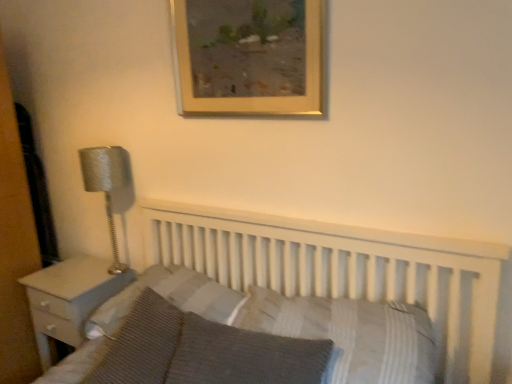
In order to face gold wooden picture frame at upper center, should I rotate leftwards or rightwards?

To align with it, rotate left about 1.813°.

This screenshot has width=512, height=384. Describe the element at coordinates (69, 299) in the screenshot. I see `white wood nightstand at left` at that location.

The width and height of the screenshot is (512, 384). Describe the element at coordinates (244, 356) in the screenshot. I see `knitted gray pillow at lower center, marked as the second pillow in a right-to-left arrangement` at that location.

The image size is (512, 384). I want to click on silver textured lamp at left, so click(x=106, y=185).

What are the coordinates of `gold wooden picture frame at upper center` in the screenshot? It's located at [x=249, y=57].

Between knitted gray pillow at lower center, marked as the second pillow in a right-to-left arrangement, and white wood nightstand at left, which one has smaller size?

knitted gray pillow at lower center, marked as the second pillow in a right-to-left arrangement, is smaller.

Is knitted gray pillow at lower center, marked as the second pillow in a right-to-left arrangement, shorter than white wood nightstand at left?

Yes.

Is point (273, 356) positioned in front of point (103, 273)?

Yes, point (273, 356) is in front of point (103, 273).

Does knitted gray pillow at lower center, which is the third pillow in left-to-right order, turn towards white wood nightstand at left?

No, knitted gray pillow at lower center, which is the third pillow in left-to-right order, is not facing towards white wood nightstand at left.

Considering the sizes of silver textured lamp at left and gold wooden picture frame at upper center in the image, is silver textured lamp at left taller or shorter than gold wooden picture frame at upper center?

Clearly, silver textured lamp at left is taller compared to gold wooden picture frame at upper center.

Are silver textured lamp at left and gold wooden picture frame at upper center far apart?

No, there isn't a large distance between silver textured lamp at left and gold wooden picture frame at upper center.

Who is bigger, silver textured lamp at left or gold wooden picture frame at upper center?

silver textured lamp at left is bigger.

Between silver textured lamp at left and gold wooden picture frame at upper center, which one has larger width?

silver textured lamp at left is wider.

Do you think white wood bed at center is within gold wooden picture frame at upper center, or outside of it?

white wood bed at center is not enclosed by gold wooden picture frame at upper center.

Considering the sizes of objects white wood bed at center and gold wooden picture frame at upper center in the image provided, who is thinner, white wood bed at center or gold wooden picture frame at upper center?

gold wooden picture frame at upper center.

Does white wood bed at center have a lesser height compared to gold wooden picture frame at upper center?

Incorrect, the height of white wood bed at center does not fall short of that of gold wooden picture frame at upper center.

From the image's perspective, which one is positioned lower, white textured pillow at center, positioned as the 4th pillow in left-to-right order, or knitted fabric pillow at lower left, acting as the first pillow starting from the left?

knitted fabric pillow at lower left, acting as the first pillow starting from the left, is shown below in the image.

From a real-world perspective, is white textured pillow at center, positioned as the 4th pillow in left-to-right order, positioned above or below knitted fabric pillow at lower left, marked as the fourth pillow in a right-to-left arrangement?

white textured pillow at center, positioned as the 4th pillow in left-to-right order, is above knitted fabric pillow at lower left, marked as the fourth pillow in a right-to-left arrangement.

Can you confirm if white textured pillow at center, which appears as the 1th pillow when viewed from the right, is wider than knitted fabric pillow at lower left, acting as the first pillow starting from the left?

Correct, the width of white textured pillow at center, which appears as the 1th pillow when viewed from the right, exceeds that of knitted fabric pillow at lower left, acting as the first pillow starting from the left.

Which of these two, white textured pillow at center, which appears as the 1th pillow when viewed from the right, or knitted fabric pillow at lower left, acting as the first pillow starting from the left, is smaller?

Smaller between the two is knitted fabric pillow at lower left, acting as the first pillow starting from the left.

From the image's perspective, which is above, gold wooden picture frame at upper center or striped fabric pillow at center, which ranks as the 3th pillow in right-to-left order?

gold wooden picture frame at upper center appears higher in the image.

From a real-world perspective, is gold wooden picture frame at upper center positioned over striped fabric pillow at center, the second pillow from the left, based on gravity?

Yes.

Is gold wooden picture frame at upper center taller than striped fabric pillow at center, the second pillow from the left?

Correct, gold wooden picture frame at upper center is much taller as striped fabric pillow at center, the second pillow from the left.

Between gold wooden picture frame at upper center and striped fabric pillow at center, which ranks as the 3th pillow in right-to-left order, which one appears on the left side from the viewer's perspective?

From the viewer's perspective, striped fabric pillow at center, which ranks as the 3th pillow in right-to-left order, appears more on the left side.

Consider the image. Between white wood nightstand at left and white textured pillow at center, positioned as the 4th pillow in left-to-right order, which one has larger size?

white wood nightstand at left is bigger.

In the scene shown: Which is correct: white wood nightstand at left is inside white textured pillow at center, which appears as the 1th pillow when viewed from the right, or outside of it?

white wood nightstand at left is not inside white textured pillow at center, which appears as the 1th pillow when viewed from the right, it's outside.

Can you tell me how much white wood nightstand at left and white textured pillow at center, which appears as the 1th pillow when viewed from the right, differ in facing direction?

The angular difference between white wood nightstand at left and white textured pillow at center, which appears as the 1th pillow when viewed from the right, is 3.62 degrees.

Is silver textured lamp at left inside knitted gray pillow at lower center, marked as the second pillow in a right-to-left arrangement?

No, silver textured lamp at left is not inside knitted gray pillow at lower center, marked as the second pillow in a right-to-left arrangement.

Could you tell me if knitted gray pillow at lower center, marked as the second pillow in a right-to-left arrangement, is facing silver textured lamp at left?

No, knitted gray pillow at lower center, marked as the second pillow in a right-to-left arrangement, is not oriented towards silver textured lamp at left.

At what (x,y) coordinates should I click in order to perform the action: click on lamp that appears above the knitted gray pillow at lower center, which is the third pillow in left-to-right order (from a real-world perspective). Please return your answer as a coordinate pair (x, y). This screenshot has height=384, width=512. Looking at the image, I should click on (106, 185).

From a real-world perspective, which is physically below, knitted gray pillow at lower center, marked as the second pillow in a right-to-left arrangement, or silver textured lamp at left?

knitted gray pillow at lower center, marked as the second pillow in a right-to-left arrangement, is physically lower.

You are a GUI agent. You are given a task and a screenshot of the screen. Output one action in this format:
    pyautogui.click(x=<x>, y=<y>)
    Task: Click on the nightstand that appears below the knitted gray pillow at lower center, marked as the second pillow in a right-to-left arrangement (from a real-world perspective)
    Image resolution: width=512 pixels, height=384 pixels.
    Given the screenshot: What is the action you would take?
    pyautogui.click(x=69, y=299)

The height and width of the screenshot is (384, 512). In order to click on lamp on the left of gold wooden picture frame at upper center in this screenshot , I will do `click(106, 185)`.

Consider the image. Considering their positions, is knitted gray pillow at lower center, which is the third pillow in left-to-right order, positioned further to striped fabric pillow at center, the second pillow from the left, than white wood bed at center?

knitted gray pillow at lower center, which is the third pillow in left-to-right order.

Which object lies nearer to the anchor point striped fabric pillow at center, the second pillow from the left, knitted fabric pillow at lower left, acting as the first pillow starting from the left, or white wood nightstand at left?

knitted fabric pillow at lower left, acting as the first pillow starting from the left.

From the image, which object appears to be nearer to knitted fabric pillow at lower left, marked as the fourth pillow in a right-to-left arrangement, silver textured lamp at left or white textured pillow at center, which appears as the 1th pillow when viewed from the right?

The object closer to knitted fabric pillow at lower left, marked as the fourth pillow in a right-to-left arrangement, is white textured pillow at center, which appears as the 1th pillow when viewed from the right.

Based on their spatial positions, is striped fabric pillow at center, which ranks as the 3th pillow in right-to-left order, or knitted gray pillow at lower center, marked as the second pillow in a right-to-left arrangement, further from white wood bed at center?

knitted gray pillow at lower center, marked as the second pillow in a right-to-left arrangement, lies further to white wood bed at center than the other object.

Based on their spatial positions, is striped fabric pillow at center, the second pillow from the left, or knitted gray pillow at lower center, marked as the second pillow in a right-to-left arrangement, further from gold wooden picture frame at upper center?

knitted gray pillow at lower center, marked as the second pillow in a right-to-left arrangement.

From the picture: Looking at the image, which one is located closer to white textured pillow at center, positioned as the 4th pillow in left-to-right order, knitted fabric pillow at lower left, marked as the fourth pillow in a right-to-left arrangement, or white wood nightstand at left?

knitted fabric pillow at lower left, marked as the fourth pillow in a right-to-left arrangement, lies closer to white textured pillow at center, positioned as the 4th pillow in left-to-right order, than the other object.

When comparing their distances from striped fabric pillow at center, which ranks as the 3th pillow in right-to-left order, does gold wooden picture frame at upper center or white wood bed at center seem closer?

white wood bed at center is closer to striped fabric pillow at center, which ranks as the 3th pillow in right-to-left order.

Considering their positions, is white wood nightstand at left positioned closer to striped fabric pillow at center, which ranks as the 3th pillow in right-to-left order, than gold wooden picture frame at upper center?

white wood nightstand at left is closer to striped fabric pillow at center, which ranks as the 3th pillow in right-to-left order.

You are a GUI agent. You are given a task and a screenshot of the screen. Output one action in this format:
    pyautogui.click(x=<x>, y=<y>)
    Task: Click on the bed between gold wooden picture frame at upper center and knitted gray pillow at lower center, which is the third pillow in left-to-right order, from top to bottom
    
    Given the screenshot: What is the action you would take?
    pyautogui.click(x=344, y=270)

Find the location of a particular element. This screenshot has width=512, height=384. lamp that lies between gold wooden picture frame at upper center and white textured pillow at center, which appears as the 1th pillow when viewed from the right, from top to bottom is located at coordinates click(x=106, y=185).

Find the location of a particular element. This screenshot has width=512, height=384. lamp between white wood nightstand at left and white textured pillow at center, positioned as the 4th pillow in left-to-right order, in the horizontal direction is located at coordinates [106, 185].

You are a GUI agent. You are given a task and a screenshot of the screen. Output one action in this format:
    pyautogui.click(x=<x>, y=<y>)
    Task: Click on the lamp between gold wooden picture frame at upper center and white wood nightstand at left in the vertical direction
    
    Given the screenshot: What is the action you would take?
    pyautogui.click(x=106, y=185)